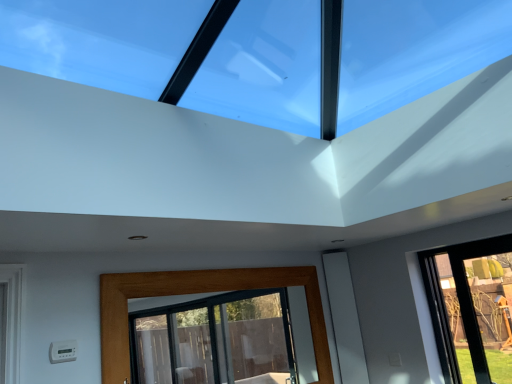
Question: Does wooden-framed glass door at lower center, marked as the 1th window in a bottom-to-top arrangement, have a larger size compared to transparent glass window at upper center, which ranks as the second window in bottom-to-top order?

Choices:
 (A) no
 (B) yes

Answer: (A)

Question: Considering the relative sizes of wooden-framed glass door at lower center, which is counted as the second window, starting from the top, and transparent glass window at upper center, placed as the 1th window when sorted from top to bottom, in the image provided, is wooden-framed glass door at lower center, which is counted as the second window, starting from the top, thinner than transparent glass window at upper center, placed as the 1th window when sorted from top to bottom,?

Choices:
 (A) no
 (B) yes

Answer: (B)

Question: Is wooden-framed glass door at lower center, marked as the 1th window in a bottom-to-top arrangement, located outside transparent glass window at upper center, which ranks as the second window in bottom-to-top order?

Choices:
 (A) yes
 (B) no

Answer: (A)

Question: Is wooden-framed glass door at lower center, which is counted as the second window, starting from the top, in front of transparent glass window at upper center, placed as the 1th window when sorted from top to bottom?

Choices:
 (A) no
 (B) yes

Answer: (A)

Question: From the image's perspective, is wooden-framed glass door at lower center, which is counted as the second window, starting from the top, on transparent glass window at upper center, which ranks as the second window in bottom-to-top order?

Choices:
 (A) no
 (B) yes

Answer: (A)

Question: Is wooden-framed glass door at lower center, which is counted as the second window, starting from the top, placed right next to transparent glass window at upper center, placed as the 1th window when sorted from top to bottom?

Choices:
 (A) yes
 (B) no

Answer: (B)

Question: Is transparent glass window at upper center, which ranks as the second window in bottom-to-top order, taller than wooden-framed glass door at lower center, which is counted as the second window, starting from the top?

Choices:
 (A) yes
 (B) no

Answer: (B)

Question: Would you say transparent glass window at upper center, which ranks as the second window in bottom-to-top order, is a long distance from wooden-framed glass door at lower center, marked as the 1th window in a bottom-to-top arrangement?

Choices:
 (A) no
 (B) yes

Answer: (B)

Question: Is transparent glass window at upper center, which ranks as the second window in bottom-to-top order, at the left side of wooden-framed glass door at lower center, which is counted as the second window, starting from the top?

Choices:
 (A) yes
 (B) no

Answer: (B)

Question: Is transparent glass window at upper center, placed as the 1th window when sorted from top to bottom, oriented towards wooden-framed glass door at lower center, marked as the 1th window in a bottom-to-top arrangement?

Choices:
 (A) yes
 (B) no

Answer: (B)

Question: Is transparent glass window at upper center, placed as the 1th window when sorted from top to bottom, facing away from wooden-framed glass door at lower center, marked as the 1th window in a bottom-to-top arrangement?

Choices:
 (A) yes
 (B) no

Answer: (B)

Question: From a real-world perspective, is transparent glass window at upper center, placed as the 1th window when sorted from top to bottom, physically above wooden-framed glass door at lower center, marked as the 1th window in a bottom-to-top arrangement?

Choices:
 (A) no
 (B) yes

Answer: (B)

Question: From a real-world perspective, is transparent glass window at upper center, placed as the 1th window when sorted from top to bottom, physically located above or below wooden-framed glass door at lower center, which is counted as the second window, starting from the top?

Choices:
 (A) above
 (B) below

Answer: (A)